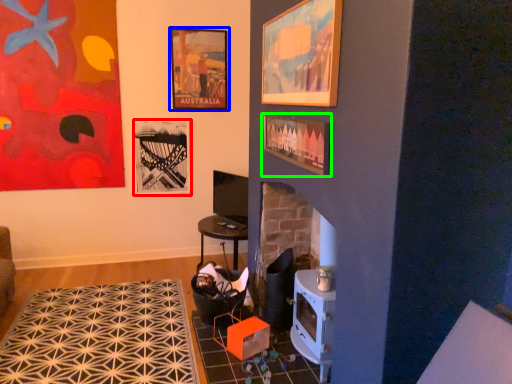
Question: Which is nearer to the picture frame (highlighted by a red box)? picture frame (highlighted by a blue box) or picture frame (highlighted by a green box).

Choices:
 (A) picture frame
 (B) picture frame

Answer: (A)